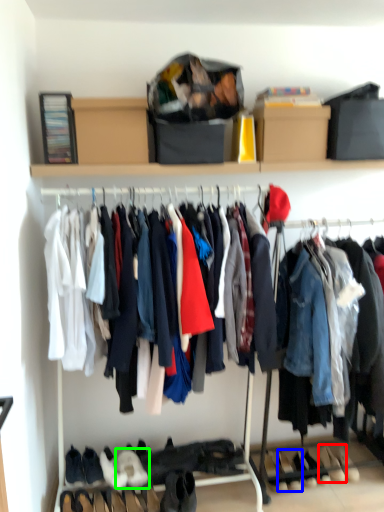
Question: Considering the real-world distances, which object is farthest from footwear (highlighted by a red box)? footwear (highlighted by a blue box) or footwear (highlighted by a green box)?

Choices:
 (A) footwear
 (B) footwear

Answer: (B)